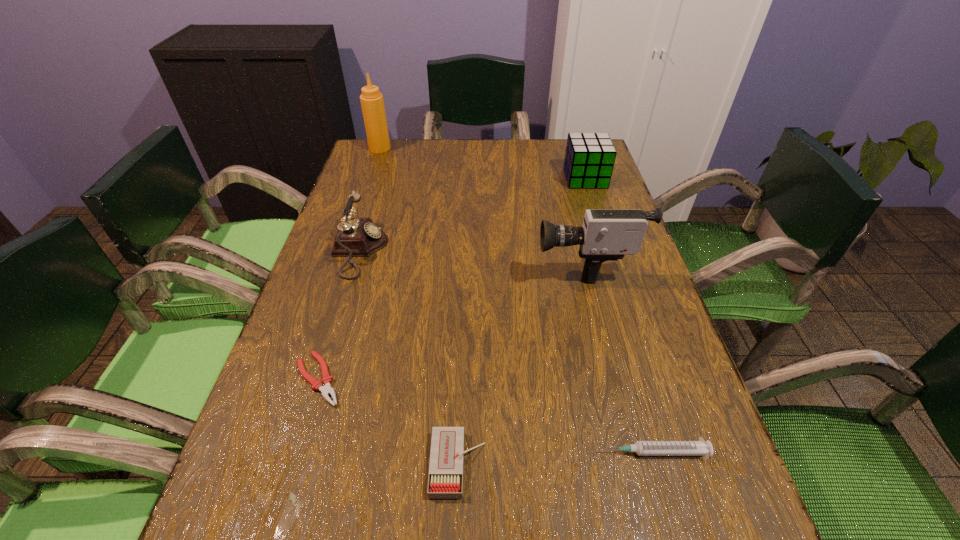
Locate an element on the screen. object located in the far right corner section of the desktop is located at coordinates (589, 159).

Identify the location of free space at the far edge of the desktop. (x=489, y=145).

In the image, there is a desktop. Where is `vacant space at the left edge`? This screenshot has height=540, width=960. vacant space at the left edge is located at coordinates (345, 305).

The height and width of the screenshot is (540, 960). I want to click on vacant space at the right edge of the desktop, so click(640, 401).

At what (x,y) coordinates should I click in order to perform the action: click on vacant space at the far left corner. Please return your answer as a coordinate pair (x, y). The width and height of the screenshot is (960, 540). Looking at the image, I should click on (394, 154).

Identify the location of vacant space that is in between the camcorder and the sixth tallest object. The image size is (960, 540). (618, 357).

The height and width of the screenshot is (540, 960). In order to click on free space between the farthest object and the fourth object from right to left in this screenshot , I will do `click(420, 306)`.

This screenshot has height=540, width=960. I want to click on vacant region between the condiment and the sixth tallest object, so click(x=516, y=300).

Locate an element on the screen. Image resolution: width=960 pixels, height=540 pixels. free space between the telephone and the tallest object is located at coordinates (370, 199).

At what (x,y) coordinates should I click in order to perform the action: click on vacant space in between the fifth tallest object and the cube. Please return your answer as a coordinate pair (x, y). Looking at the image, I should click on (521, 321).